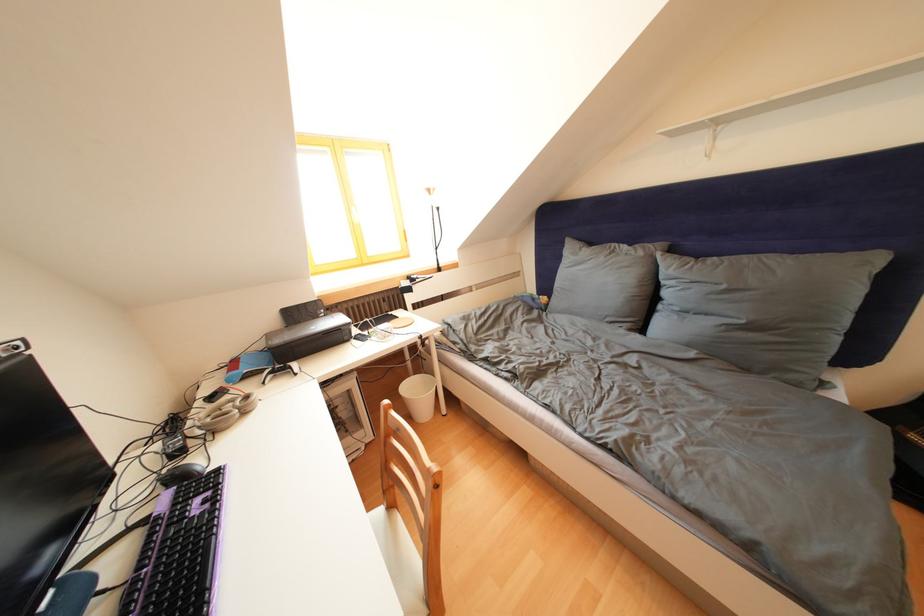
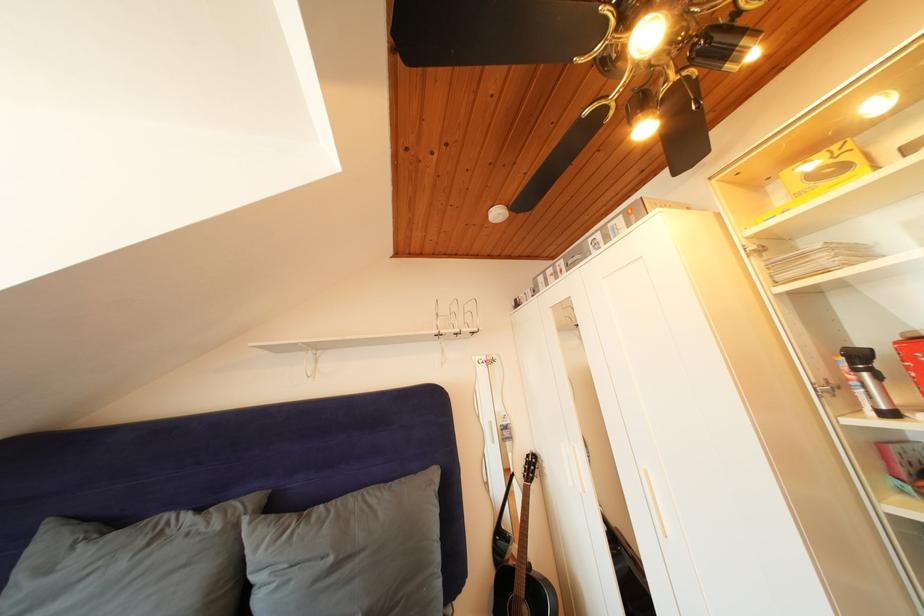
Find the pixel in the second image that matches point (733, 292) in the first image.

(338, 565)